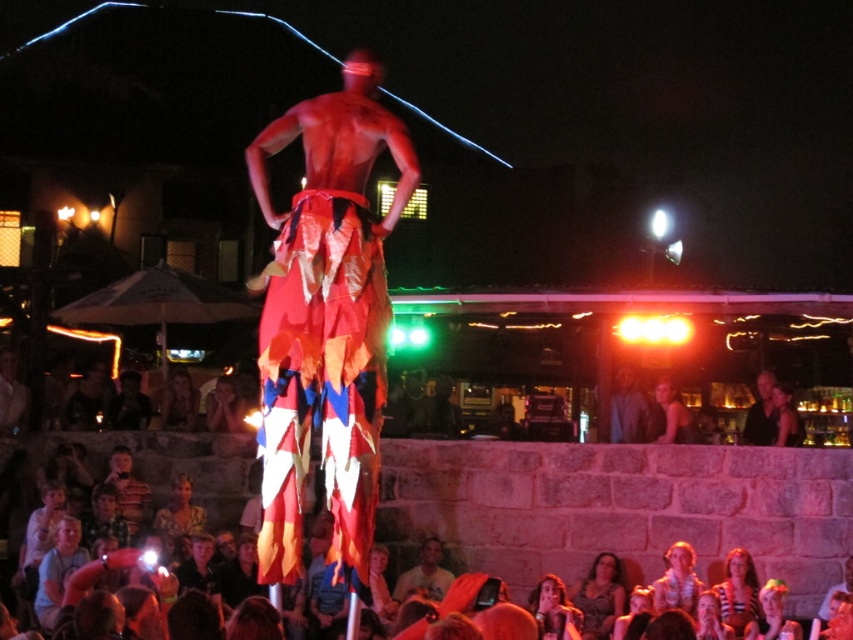
Is point (67, 525) positioned behind point (164, 403)?

No, it is in front of (164, 403).

Who is higher up, light blue cotton shirt at lower left or smooth skin face at lower center?

smooth skin face at lower center

Is point (56, 605) closer to camera compared to point (160, 426)?

Yes, point (56, 605) is in front of point (160, 426).

Find the location of `light blue cotton shirt at lower left`. light blue cotton shirt at lower left is located at coordinates (57, 570).

Describe the element at coordinates (326, 320) in the screenshot. I see `red fabric pants at center` at that location.

From the picture: Is red fabric pants at center to the left of smooth skin face at center from the viewer's perspective?

No, red fabric pants at center is not to the left of smooth skin face at center.

Describe the element at coordinates (326, 320) in the screenshot. This screenshot has width=853, height=640. I see `red fabric pants at center` at that location.

Locate an element on the screen. The image size is (853, 640). red fabric pants at center is located at coordinates (326, 320).

Who is more distant from viewer, (726, 618) or (759, 385)?

The point (759, 385) is behind.

Does striped shirt at lower right have a greater height compared to smooth black shirt at right?

Incorrect, striped shirt at lower right's height is not larger of smooth black shirt at right's.

Does point (757, 612) come behind point (759, 426)?

No.

Locate an element on the screen. striped shirt at lower right is located at coordinates (738, 593).